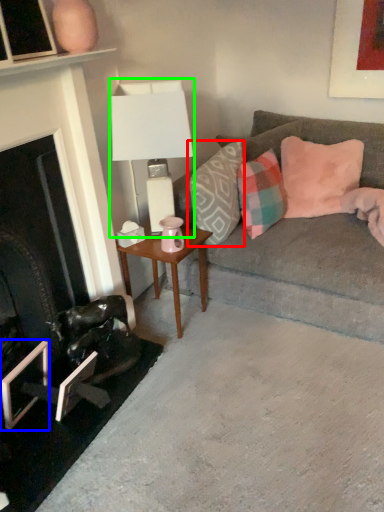
Question: Which is nearer to the pillow (highlighted by a red box)? picture frame (highlighted by a blue box) or table lamp (highlighted by a green box).

Choices:
 (A) picture frame
 (B) table lamp

Answer: (B)